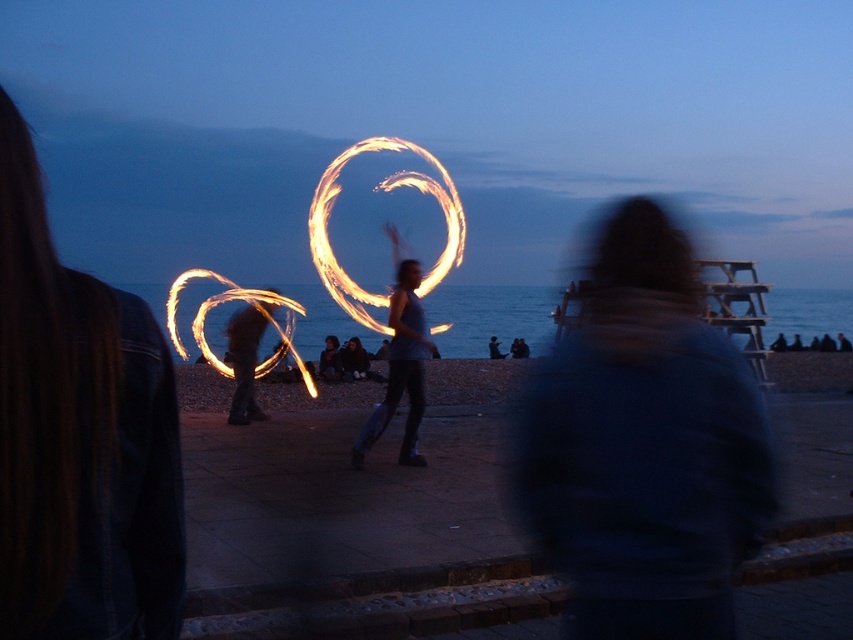
You are a photographer trying to capture the fire performance at the seaside. You notice the dark blue fabric at center and the silvery metallic fire hoop at center. Which object is closer to the camera in the scene?

The dark blue fabric at center is positioned over the silvery metallic fire hoop at center, so it is closer to the camera.

You are a photographer trying to capture the fire performance. You notice the fluorescent orange fire at center and the silvery metallic fire hoop at center. Which one appears wider in the image?

The fluorescent orange fire at center appears wider than the silvery metallic fire hoop at center because its width surpasses the hoop.

You are standing at the origin point of the coordinate system in the image. The fluorescent orange fire at center is at coordinates approximately 0.3, 0.45. If you want to walk directly towards the fire, which direction should you move in terms of the coordinate system?

To move directly towards the fluorescent orange fire at center located at coordinates approximately (383, 192) from the origin, you should move in the positive x and positive y direction since the fire is at higher x and y values than the origin.